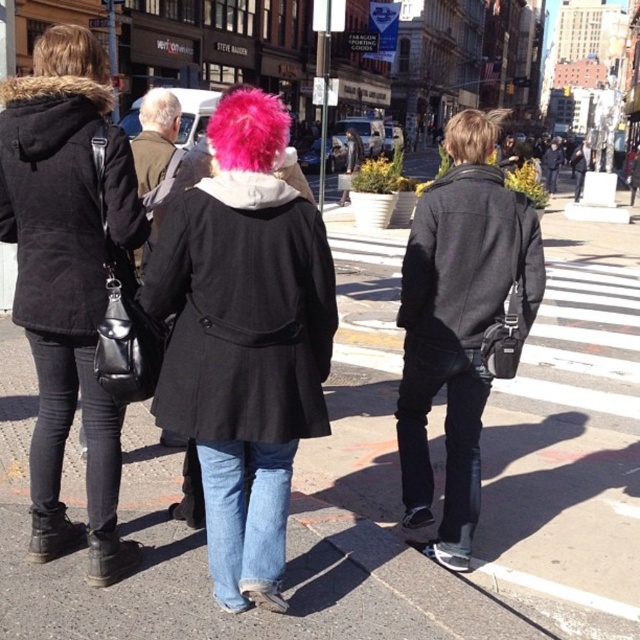
Question: Is matte black jacket at left thinner than gray matte hair at upper left?

Choices:
 (A) yes
 (B) no

Answer: (A)

Question: Does black fuzzy coat at left appear on the left side of dark gray wool coat at center?

Choices:
 (A) no
 (B) yes

Answer: (B)

Question: Does dark gray wool coat at center appear over blonde hair at upper left?

Choices:
 (A) no
 (B) yes

Answer: (A)

Question: Which point appears closest to the camera in this image?

Choices:
 (A) (80, 179)
 (B) (426, 458)

Answer: (A)

Question: Estimate the real-world distances between objects in this image. Which object is closer to the fuzzy pink hair at center?

Choices:
 (A) blonde hair at center
 (B) gray matte hair at upper left
 (C) matte black coat at center
 (D) black fuzzy coat at left

Answer: (D)

Question: Which of the following is the closest to the observer?

Choices:
 (A) black wool coat at center
 (B) blonde hair at center
 (C) matte black coat at center

Answer: (A)